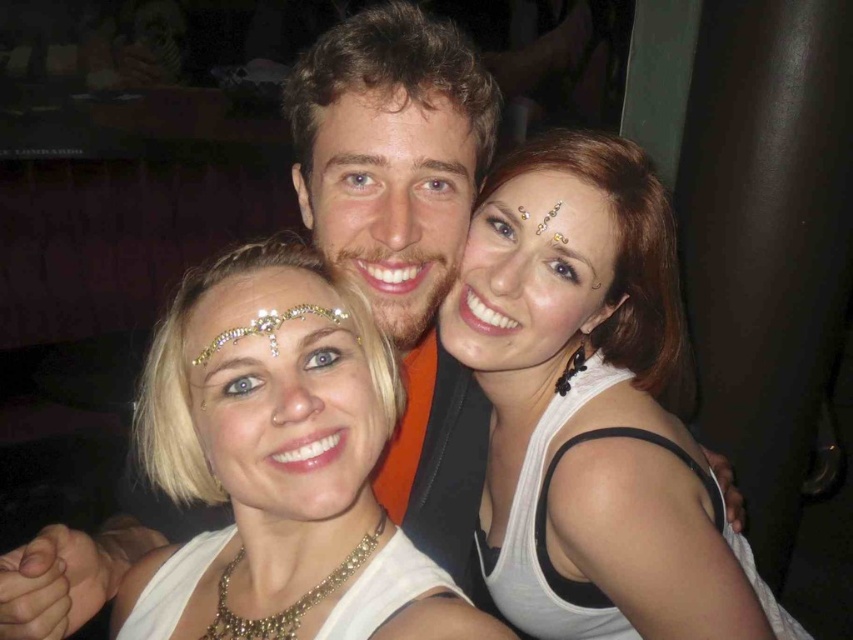
You are a photographer adjusting the lighting for a portrait. You notice the white matte tank top at center and the matte skin face at center. Which object should you focus on first to ensure proper exposure, the one that is closer to the camera or the one further away?

The white matte tank top at center is below matte skin face at center, so the matte skin face at center is closer to the camera. Focus on the matte skin face at center first to ensure proper exposure.

You are standing at the camera position and want to reach point (718, 588). If you can move forward 35 inches, will you reach that point?

Yes, because the distance between the camera and point (718, 588) is 34.84 inches, so moving forward 35 inches will get you there.

You are standing in front of the image and want to touch the white matte tank top at center. If your hand can reach up to 32 inches, will you be able to touch it?

The white matte tank top at center is 34.03 inches away from the viewer, which is beyond the 32 inches reach of your hand. Therefore, you cannot touch it.